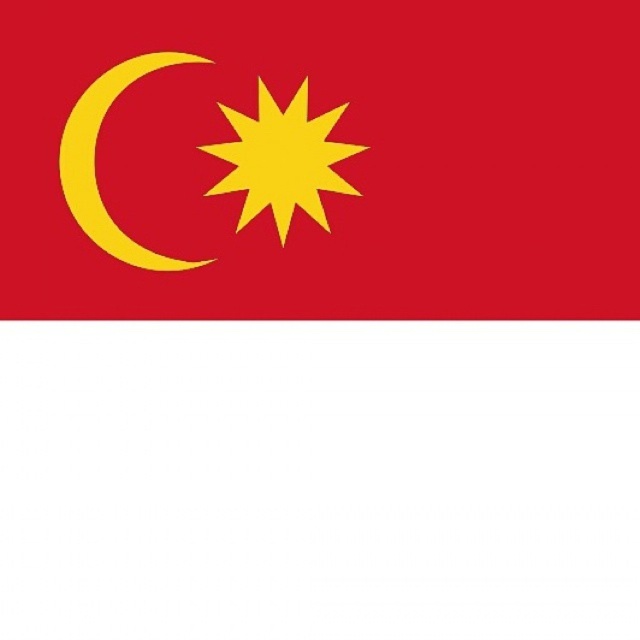
Question: Does matte red flag at upper left have a larger size compared to matte yellow crescent at upper left?

Choices:
 (A) yes
 (B) no

Answer: (A)

Question: Where is matte red flag at upper left located in relation to matte yellow crescent at upper left in the image?

Choices:
 (A) left
 (B) right

Answer: (B)

Question: Observing the image, what is the correct spatial positioning of matte red flag at upper left in reference to matte yellow crescent at upper left?

Choices:
 (A) right
 (B) left

Answer: (A)

Question: Which of the following is the closest to the observer?

Choices:
 (A) matte red flag at upper left
 (B) matte yellow crescent at upper left

Answer: (A)